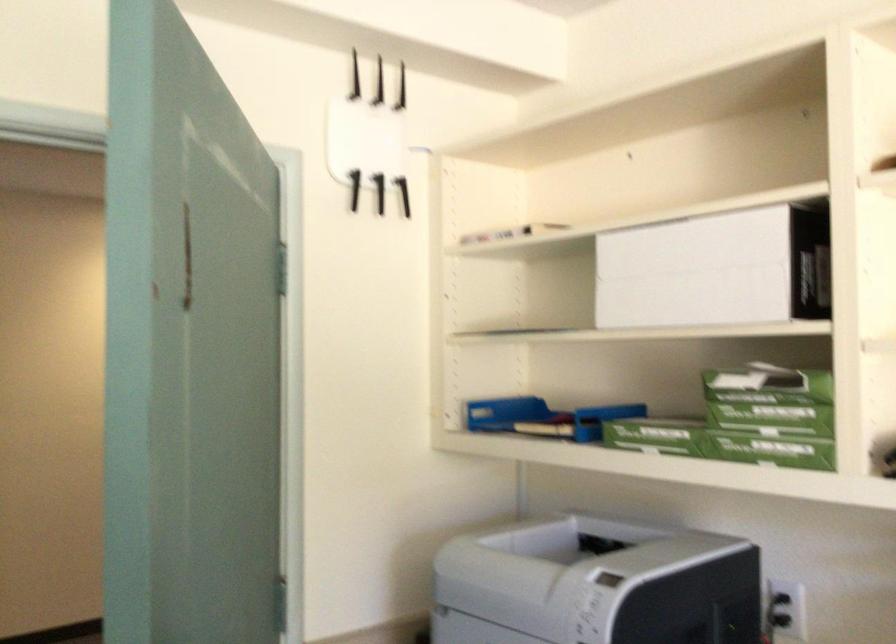
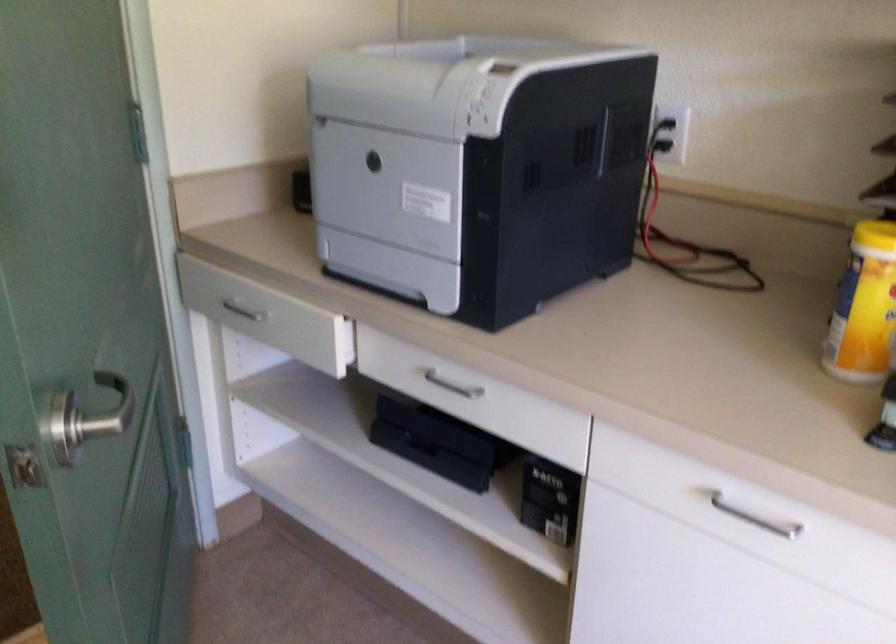
Question: Based on the continuous images, in which direction is the camera rotating? Reply with the corresponding letter.

Choices:
 (A) Left
 (B) Right
 (C) Up
 (D) Down

Answer: (D)